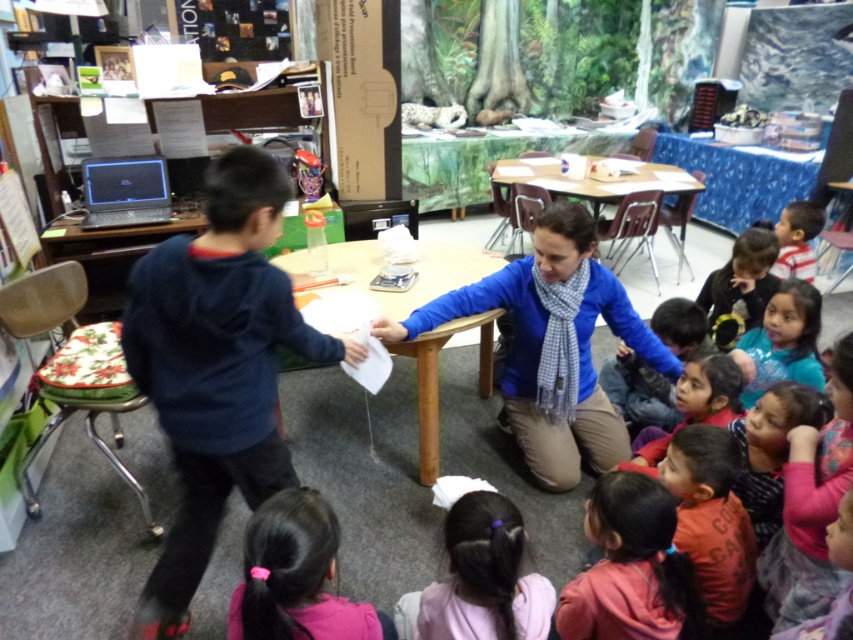
Question: Does blue woolen sweater at center have a lesser width compared to blue fabric shirt at lower right?

Choices:
 (A) no
 (B) yes

Answer: (A)

Question: Is blue fabric shirt at lower right below dark blue sweater at lower right?

Choices:
 (A) no
 (B) yes

Answer: (B)

Question: Estimate the real-world distances between objects in this image. Which object is farther from the dark blue sweater at lower right?

Choices:
 (A) purple hairband at lower center
 (B) pink fabric hair tie at lower center
 (C) blue fabric shirt at lower right

Answer: (A)

Question: Can you confirm if pink fabric ponytail at lower center is positioned below dark blue sweater at lower right?

Choices:
 (A) no
 (B) yes

Answer: (B)

Question: Which point is farther to the camera?

Choices:
 (A) purple hairband at lower center
 (B) pink fabric ponytail at lower center
 (C) dark blue sweater at lower right

Answer: (C)

Question: Which object is positioned farthest from the pink fabric hair tie at lower center?

Choices:
 (A) blue fabric shirt at lower right
 (B) dark blue sweater at lower right
 (C) purple hairband at lower center

Answer: (B)